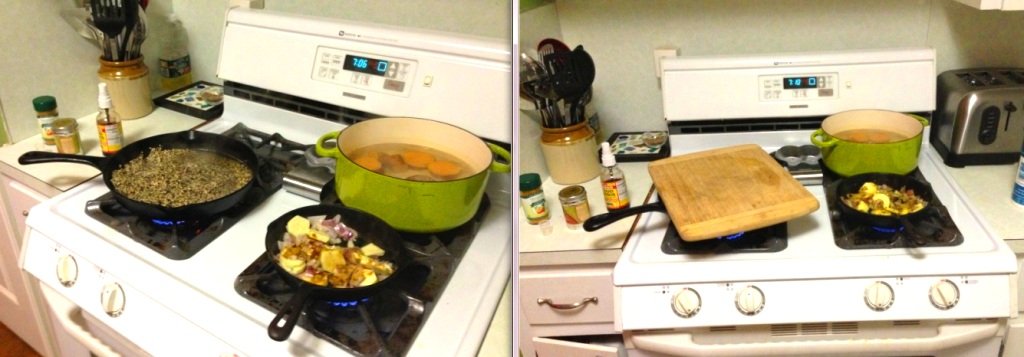
Locate an element on the screen. handle is located at coordinates (76, 157).